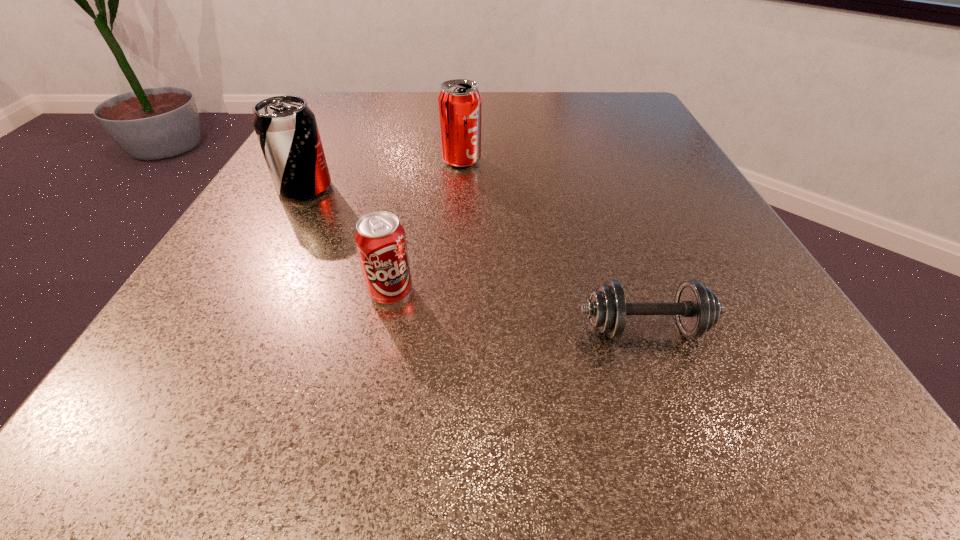
The height and width of the screenshot is (540, 960). I want to click on the farthest object, so click(459, 101).

The image size is (960, 540). I want to click on the rightmost soda, so click(x=459, y=101).

I want to click on the second nearest soda, so click(286, 128).

Where is `the leftmost soda`? The image size is (960, 540). the leftmost soda is located at coordinates (286, 128).

Where is `the shortest soda`? The height and width of the screenshot is (540, 960). the shortest soda is located at coordinates (380, 239).

Locate an element on the screen. Image resolution: width=960 pixels, height=540 pixels. the second soda from left to right is located at coordinates tap(380, 239).

Where is `the rightmost object`? the rightmost object is located at coordinates (697, 309).

Locate an element on the screen. dumbbell is located at coordinates click(697, 309).

The height and width of the screenshot is (540, 960). What are the coordinates of `vacant area located on the front of the farthest soda` in the screenshot? It's located at (455, 273).

Where is `free space located on the right of the leftmost object`? Image resolution: width=960 pixels, height=540 pixels. free space located on the right of the leftmost object is located at coordinates (554, 188).